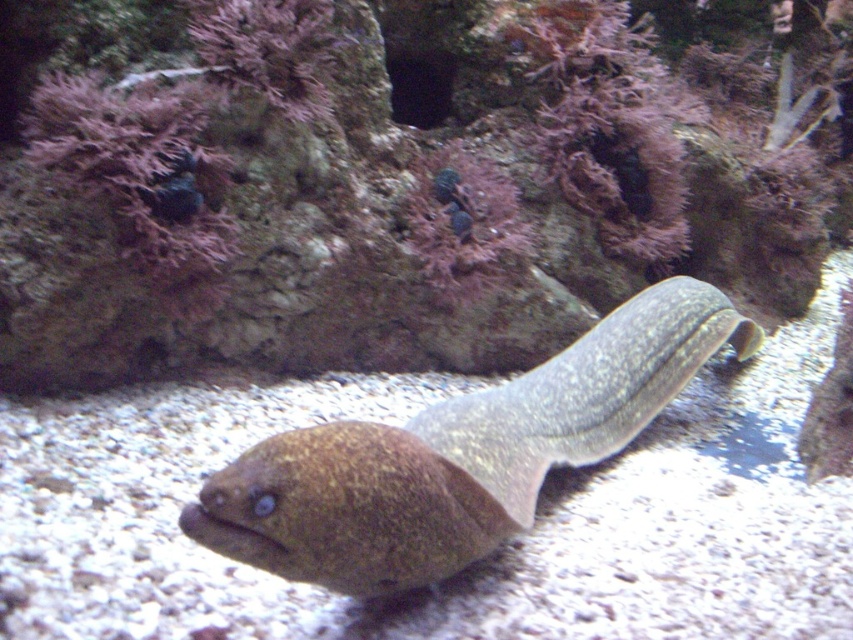
Question: Which point is closer to the camera?

Choices:
 (A) brown speckled eel at center
 (B) purple coral at upper center
 (C) purple coral at center

Answer: (A)

Question: Which point is farther from the camera taking this photo?

Choices:
 (A) (338, 563)
 (B) (595, 202)
 (C) (496, 257)

Answer: (B)

Question: Can you confirm if brown speckled eel at center is thinner than purple coral at center?

Choices:
 (A) yes
 (B) no

Answer: (B)

Question: Which object is the closest to the brown speckled eel at center?

Choices:
 (A) purple coral at upper center
 (B) purple coral at center

Answer: (A)

Question: Where is brown speckled eel at center located in relation to purple coral at center in the image?

Choices:
 (A) right
 (B) left

Answer: (B)

Question: Observing the image, what is the correct spatial positioning of purple coral at center in reference to purple coral at upper center?

Choices:
 (A) above
 (B) below

Answer: (A)